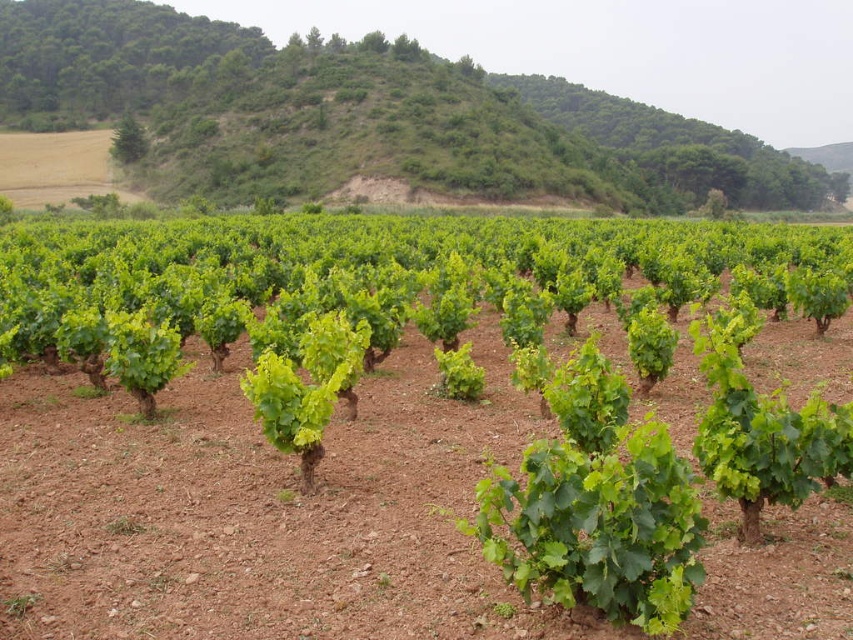
Question: Can you confirm if green leafy vines at center is smaller than green leafy hillside at upper center?

Choices:
 (A) no
 (B) yes

Answer: (B)

Question: Is green leafy vines at center bigger than green leafy hillside at upper center?

Choices:
 (A) yes
 (B) no

Answer: (B)

Question: Can you confirm if green leafy vines at center is positioned to the left of green leafy hillside at upper center?

Choices:
 (A) yes
 (B) no

Answer: (B)

Question: Which point is farther to the camera?

Choices:
 (A) green leafy vines at center
 (B) green leafy hillside at upper center

Answer: (B)